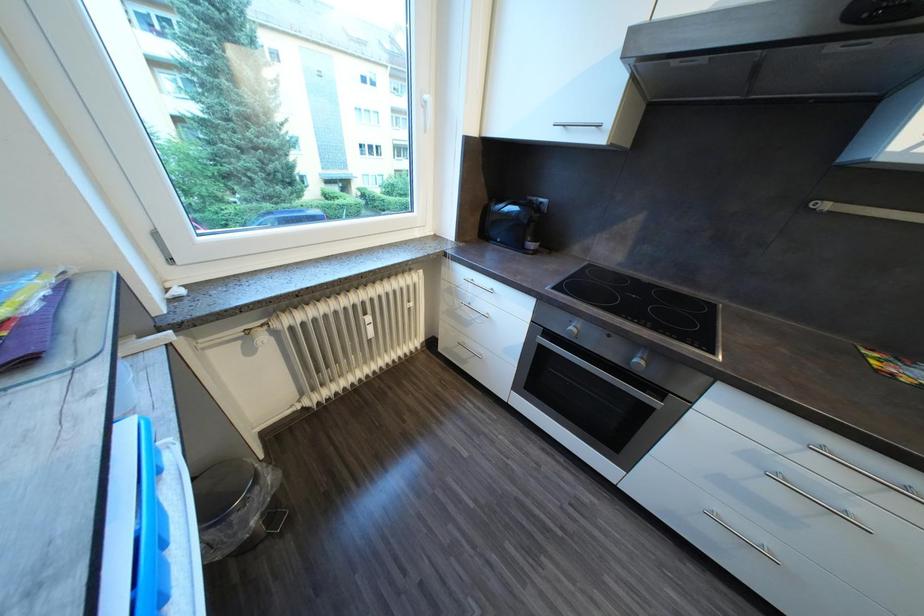
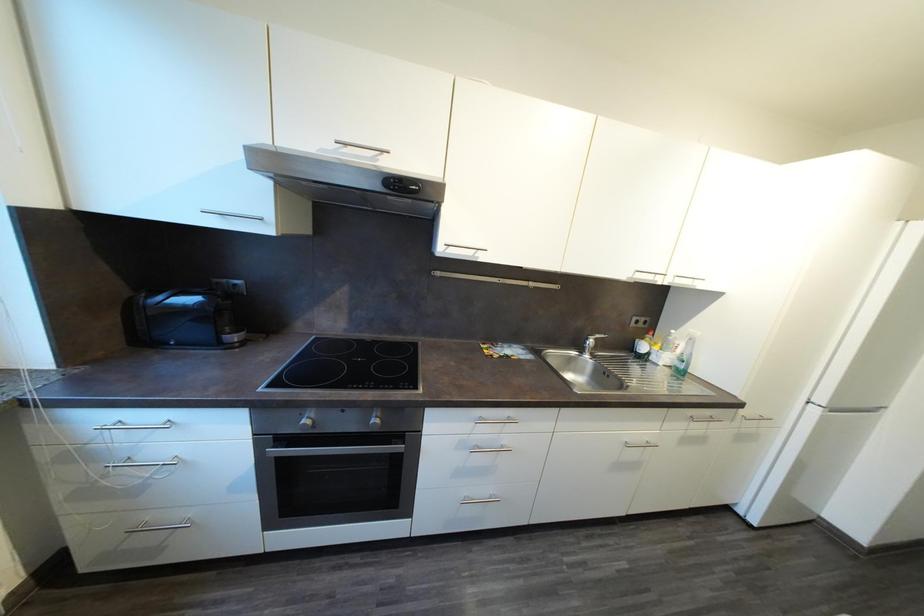
Question: The camera is either moving clockwise (left) or counter-clockwise (right) around the object. The first image is from the beginning of the video and the second image is from the end. Is the camera moving left or right when shooting the video?

Choices:
 (A) Left
 (B) Right

Answer: (A)